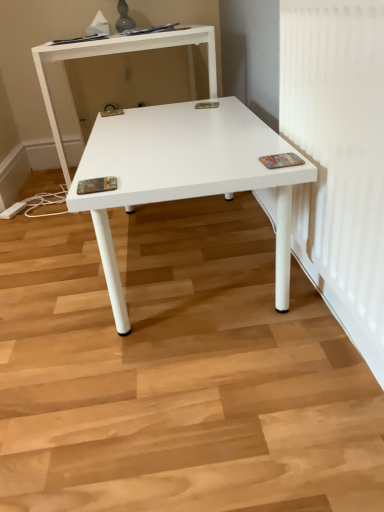
In order to face white matte table at center, should I rotate leftwards or rightwards?

Turn left approximately 7.609 degrees to face it.

Identify the location of white matte table at center. The width and height of the screenshot is (384, 512). (120, 53).

Describe the element at coordinates (120, 53) in the screenshot. I see `white matte table at center` at that location.

This screenshot has width=384, height=512. I want to click on white matte table at center, so click(x=120, y=53).